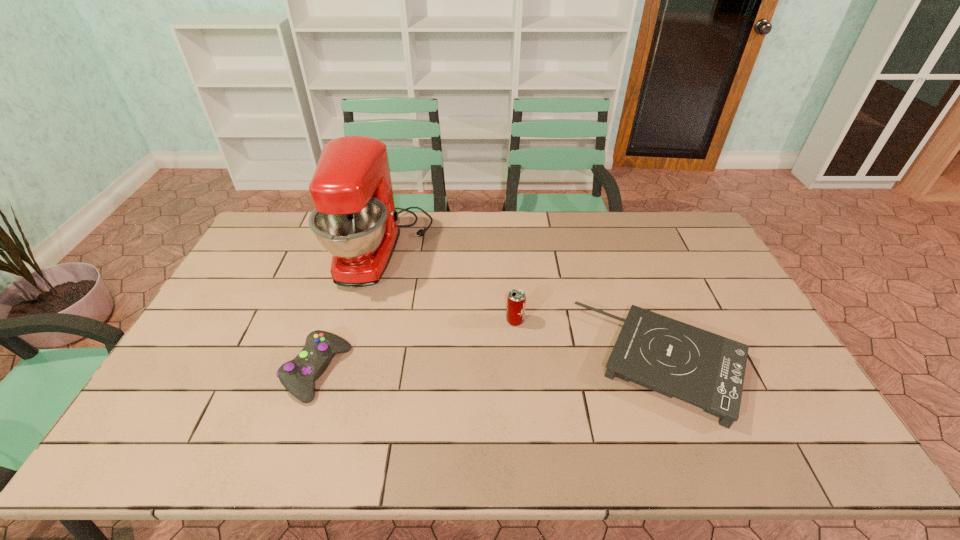
The width and height of the screenshot is (960, 540). What are the coordinates of `vacant region at the far right corner` in the screenshot? It's located at (684, 224).

Image resolution: width=960 pixels, height=540 pixels. I want to click on free point between the second tallest object and the hotplate, so click(x=589, y=342).

The image size is (960, 540). I want to click on unoccupied area between the control and the shortest object, so click(491, 367).

This screenshot has width=960, height=540. I want to click on free space between the farthest object and the third shortest object, so click(448, 285).

Where is `empty space that is in between the kitchen mixer and the control`? The height and width of the screenshot is (540, 960). empty space that is in between the kitchen mixer and the control is located at coordinates (349, 311).

Identify the location of vacant space that's between the farthest object and the control. The height and width of the screenshot is (540, 960). (349, 311).

Find the location of a particular element. The height and width of the screenshot is (540, 960). vacant region between the third object from left to right and the rightmost object is located at coordinates [589, 342].

What are the coordinates of `vacant region between the hotplate and the second object from right to left` in the screenshot? It's located at (589, 342).

Where is `free space between the shortest object and the second object from right to left`? The image size is (960, 540). free space between the shortest object and the second object from right to left is located at coordinates (589, 342).

Locate which object ranks in proximity to the farthest object. Please provide its 2D coordinates. Your answer should be formatted as a tuple, i.e. [(x, y)], where the tuple contains the x and y coordinates of a point satisfying the conditions above.

[(298, 375)]